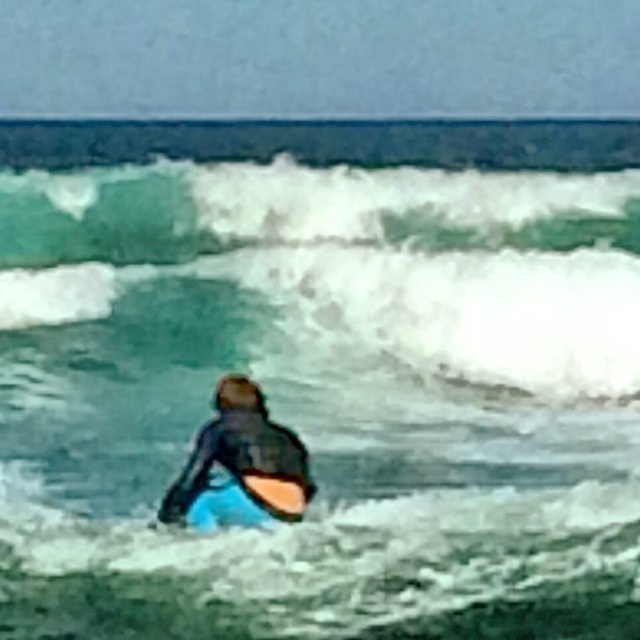
You are a photographer trying to capture the surfer in the scene. You need to ensure the green translucent water at upper center and the black matte wetsuit at center are both visible in your shot. Given their sizes, which object will occupy more of the frame?

The green translucent water at upper center has a larger size compared to the black matte wetsuit at center, so it will occupy more of the frame.

You are a photographer trying to capture the surfer in the image. You want to ensure the orange foam surfboard at center is fully visible in your shot. Given the green translucent water at upper center, will the surfboard fit horizontally within the water area?

The green translucent water at upper center has a larger width than the orange foam surfboard at center. Therefore, the surfboard will fit horizontally within the water area.